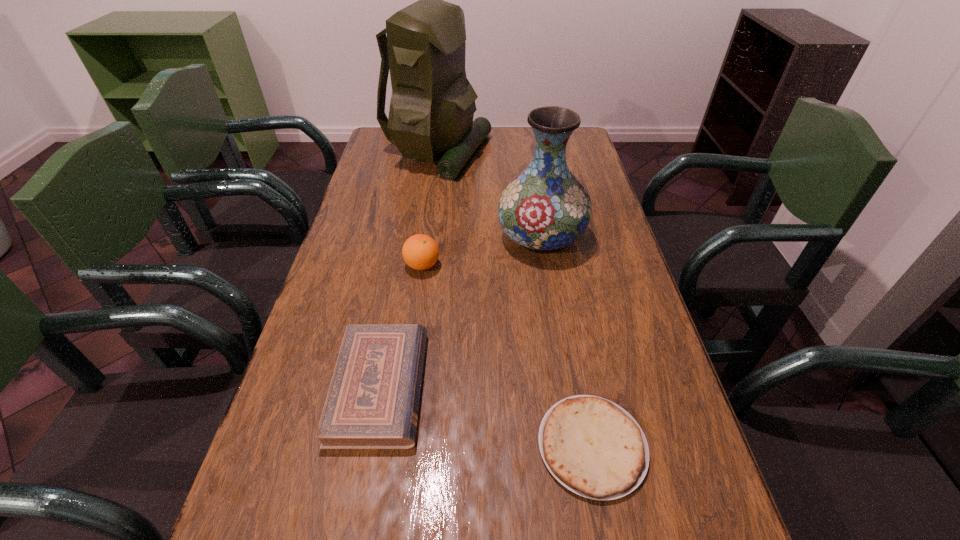
This screenshot has height=540, width=960. I want to click on blank area located on the right of the tortilla, so click(696, 446).

This screenshot has width=960, height=540. I want to click on object at the far edge, so click(x=432, y=106).

Identify the location of backpack located at the left edge. (432, 106).

Where is `Bible located in the left edge section of the desktop`? The image size is (960, 540). Bible located in the left edge section of the desktop is located at coordinates (373, 399).

Find the location of a particular element. The height and width of the screenshot is (540, 960). vase positioned at the right edge is located at coordinates (545, 208).

At what (x,y) coordinates should I click in order to perform the action: click on tortilla located in the right edge section of the desktop. Please return your answer as a coordinate pair (x, y). Looking at the image, I should click on (593, 447).

Find the location of a particular element. This screenshot has width=960, height=540. object present at the far left corner is located at coordinates (432, 106).

The width and height of the screenshot is (960, 540). In order to click on free space at the far edge of the desktop in this screenshot , I will do coord(523,143).

Image resolution: width=960 pixels, height=540 pixels. I want to click on vacant space at the left edge, so click(306, 377).

Where is `blank space at the right edge of the desktop`? blank space at the right edge of the desktop is located at coordinates (696, 530).